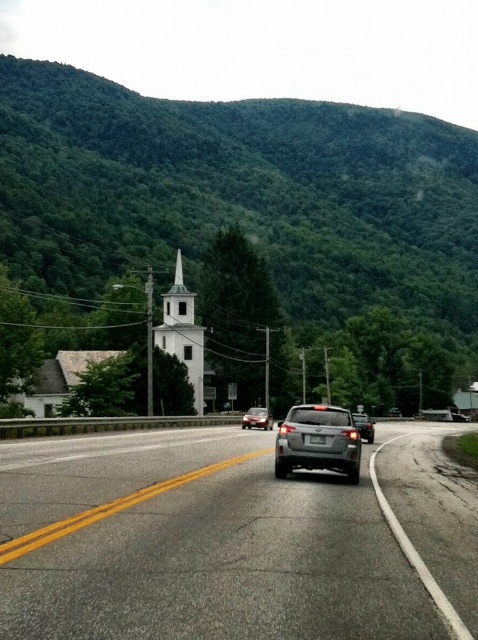
You are a drone operator who needs to fly a drone from the green leafy mountain at upper center to the white smooth steeple at center. The drone has a maximum range of 350 feet. Can the drone reach the steeple without needing to recharge?

The distance between the green leafy mountain at upper center and the white smooth steeple at center is 361.21 feet, which exceeds the drone operator drone has a maximum range of 350 feet. Therefore, the drone cannot reach the steeple without needing to recharge.

You are a driver approaching the rural road with a small white church in the distance. You see a silver SUV driving away from you in the foreground and a point marked at coordinates (183, 332). What does this point indicate?

The point at coordinates (183, 332) corresponds to the white smooth steeple at center, indicating the location of the church in the scene.